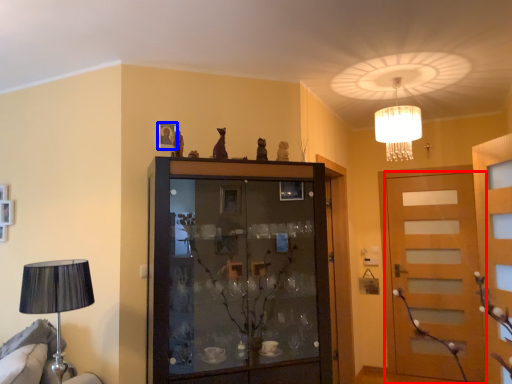
Question: Which of the following is the farthest to the observer, door (highlighted by a red box) or picture frame (highlighted by a blue box)?

Choices:
 (A) door
 (B) picture frame

Answer: (A)